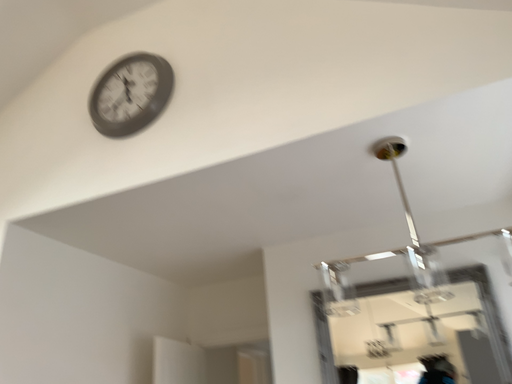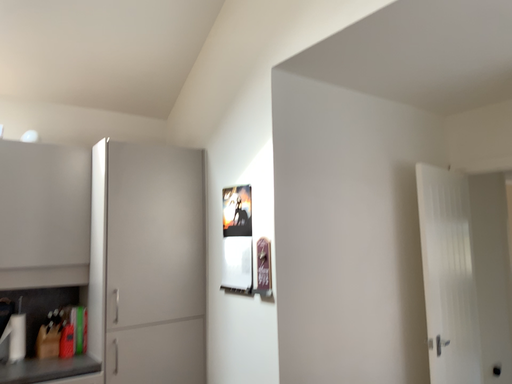
Question: How did the camera likely rotate when shooting the video?

Choices:
 (A) rotated downward
 (B) rotated upward

Answer: (A)